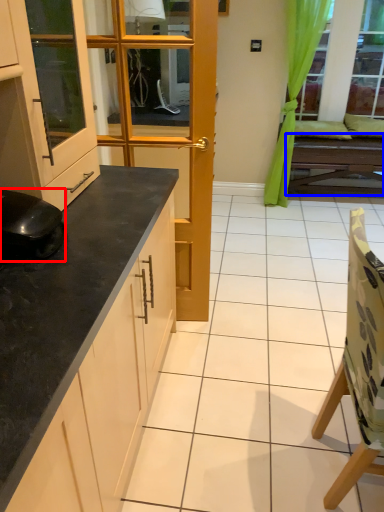
Question: Which object appears farthest to the camera in this image, appliance (highlighted by a red box) or table (highlighted by a blue box)?

Choices:
 (A) appliance
 (B) table

Answer: (B)